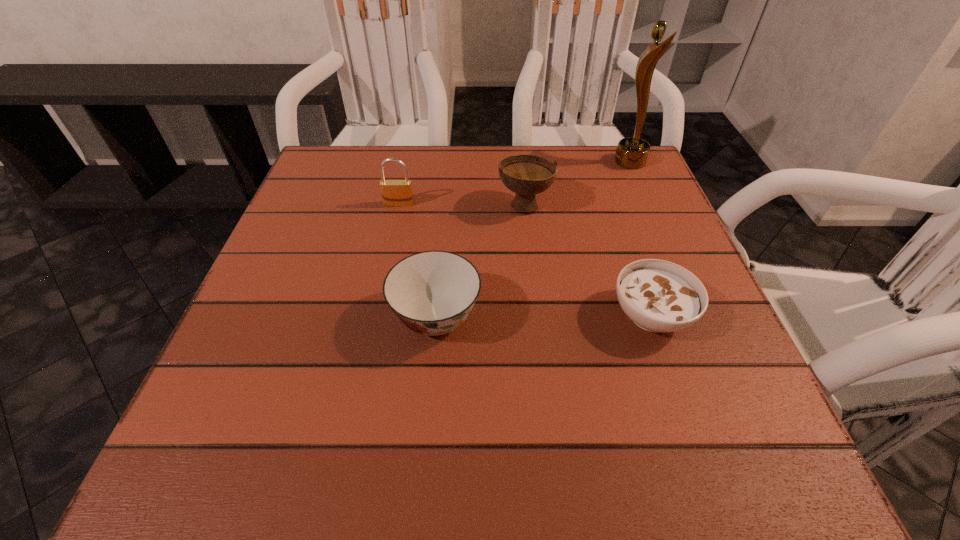
This screenshot has width=960, height=540. Find the location of `object at the far right corner`. object at the far right corner is located at coordinates (632, 152).

Image resolution: width=960 pixels, height=540 pixels. I want to click on vacant space at the far edge, so click(442, 161).

Where is `free space at the left edge of the desktop`? This screenshot has width=960, height=540. free space at the left edge of the desktop is located at coordinates (321, 264).

The height and width of the screenshot is (540, 960). In order to click on free space at the right edge of the desktop in this screenshot , I will do `click(607, 255)`.

In the image, there is a desktop. Where is `vacant area at the far left corner`? Image resolution: width=960 pixels, height=540 pixels. vacant area at the far left corner is located at coordinates (345, 174).

Locate an element on the screen. vacant region at the near right corner is located at coordinates (699, 463).

The width and height of the screenshot is (960, 540). Identify the location of free space between the farthest soup bowl and the award. coord(578,183).

Locate an element on the screen. Image resolution: width=960 pixels, height=540 pixels. blank region between the second soup bowl from right to left and the padlock is located at coordinates (462, 204).

Image resolution: width=960 pixels, height=540 pixels. I want to click on free spot between the shortest soup bowl and the leftmost soup bowl, so click(x=543, y=316).

This screenshot has width=960, height=540. In order to click on free area in between the padlock and the second soup bowl from right to left in this screenshot , I will do `click(462, 204)`.